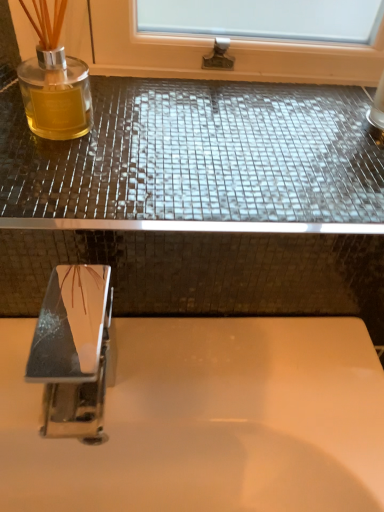
Question: Which is correct: white glossy sink at center is inside polished chrome tap at lower left, or outside of it?

Choices:
 (A) inside
 (B) outside

Answer: (B)

Question: In terms of height, does white glossy sink at center look taller or shorter compared to polished chrome tap at lower left?

Choices:
 (A) short
 (B) tall

Answer: (B)

Question: Which is nearer to the white glossy sink at center?

Choices:
 (A) polished chrome tap at lower left
 (B) shiny mosaic tile counter top at upper center

Answer: (A)

Question: Estimate the real-world distances between objects in this image. Which object is closer to the polished chrome tap at lower left?

Choices:
 (A) white glossy sink at center
 (B) shiny mosaic tile counter top at upper center

Answer: (A)